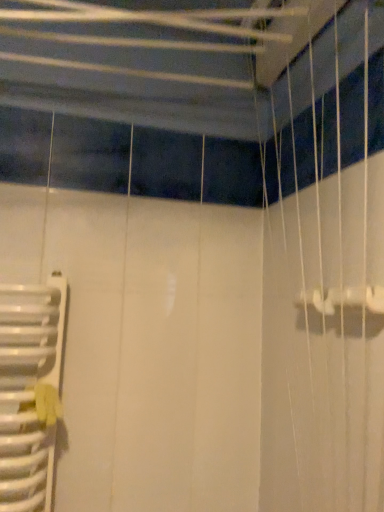
The width and height of the screenshot is (384, 512). What do you see at coordinates (325, 274) in the screenshot?
I see `white matte shower curtain at right` at bounding box center [325, 274].

The image size is (384, 512). In order to click on white matte shower curtain at right in this screenshot , I will do `click(325, 274)`.

I want to click on white matte shower curtain at right, so click(325, 274).